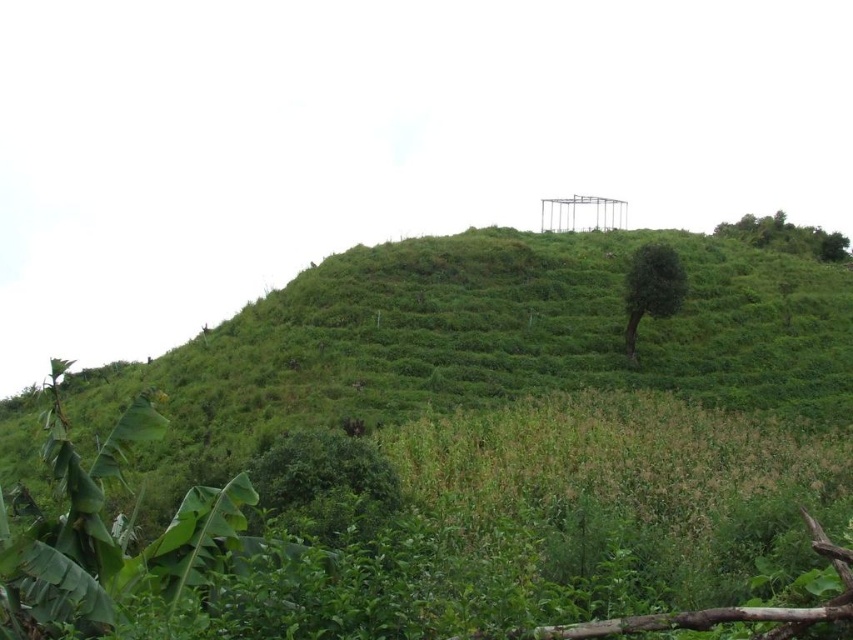
You are a hiker standing at the base of the hill. You see the green leafy tree at center and the green leafy tree at upper right. Which tree is closer to you?

The green leafy tree at center is closer to you because it is positioned lower on the hill compared to the green leafy tree at upper right, which is situated higher up the slope.

You are standing on the hillside and want to reach the green leafy tree at center. Given that the average walking pace is 3 feet per second, how many seconds will it take you to reach the tree?

The green leafy tree at center is 168.64 feet away from the viewer. At an average walking pace of 3 feet per second, it would take approximately 56.21 seconds to reach the tree.